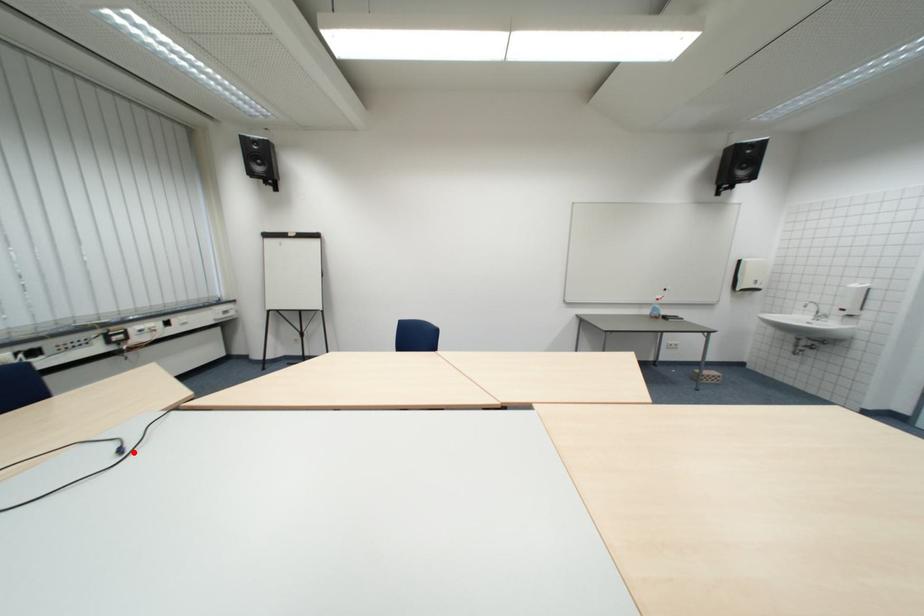
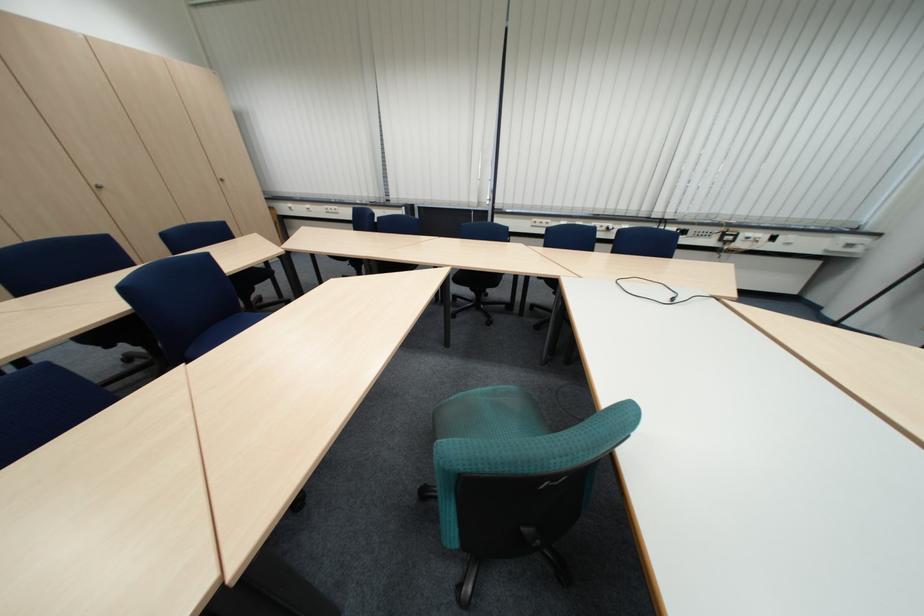
Where in the second image is the point corresponding to the highlighted location from the first image?

(687, 301)